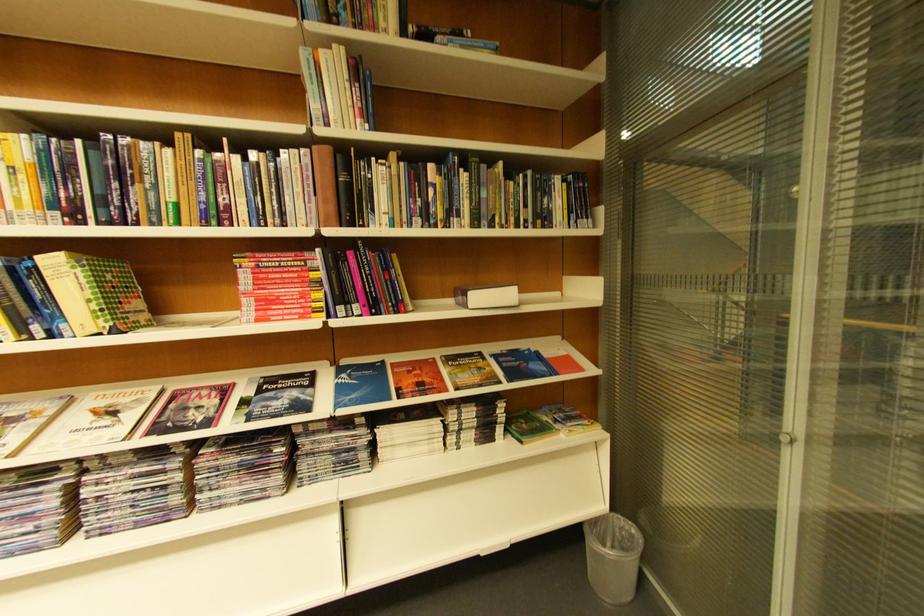
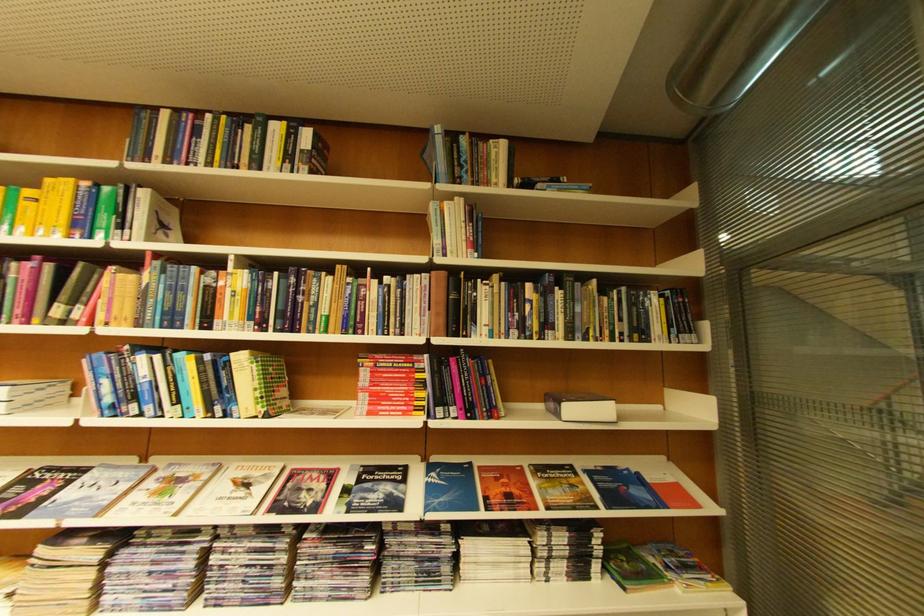
Question: Based on the continuous images, in which direction is the camera rotating? Reply with the corresponding letter.

Choices:
 (A) Left
 (B) Right
 (C) Up
 (D) Down

Answer: (A)